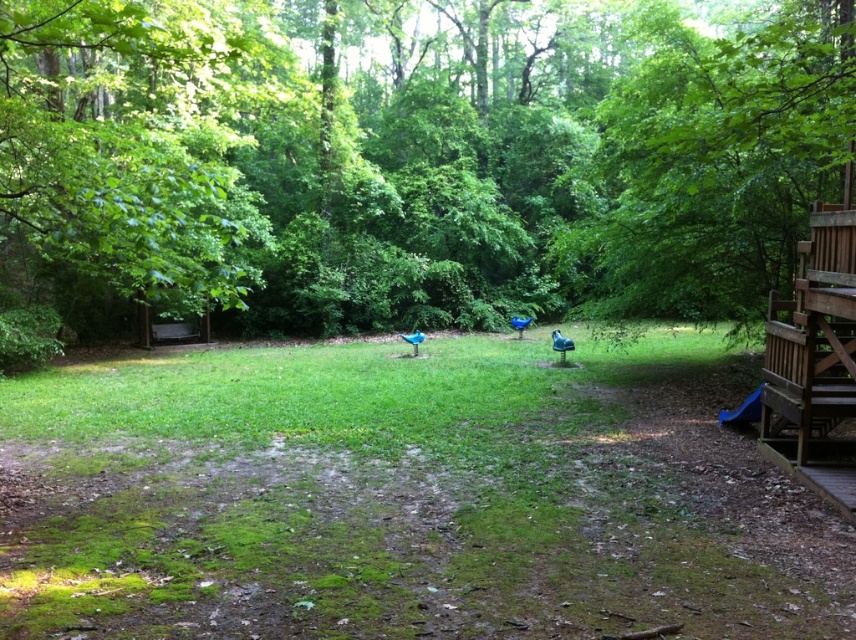
You are planning to plant a new tree in your backyard. You notice the green leafy tree at center and the green grass at center. Which one should you consider in terms of space requirements for the new tree?

The green leafy tree at center is larger in size than the green grass at center, so you should consider the space requirements of the green leafy tree at center when planning to plant a new tree.

You are a gardener checking the backyard. You notice the green grass at center and the blue glossy bird at center. Which one is taller?

The green grass at center is taller than the blue glossy bird at center.